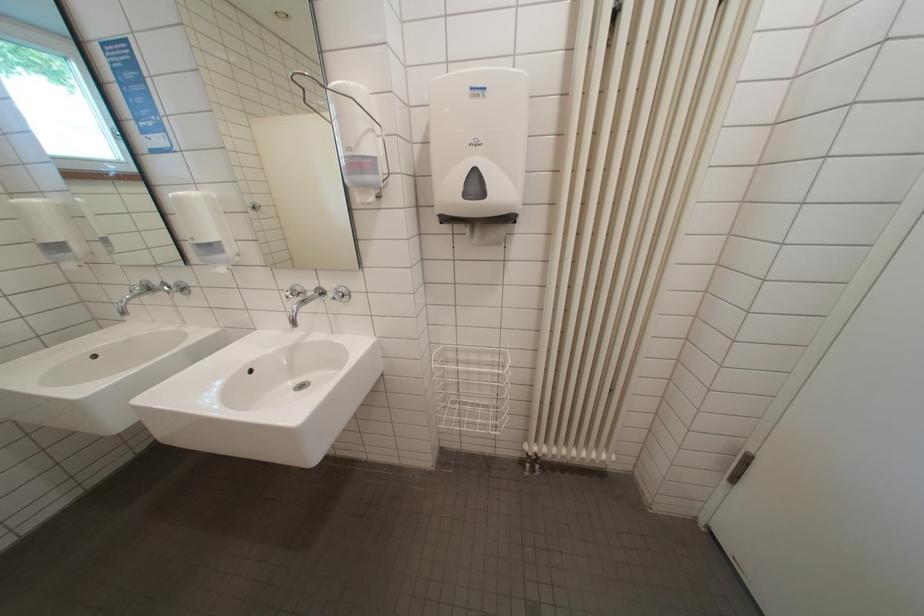
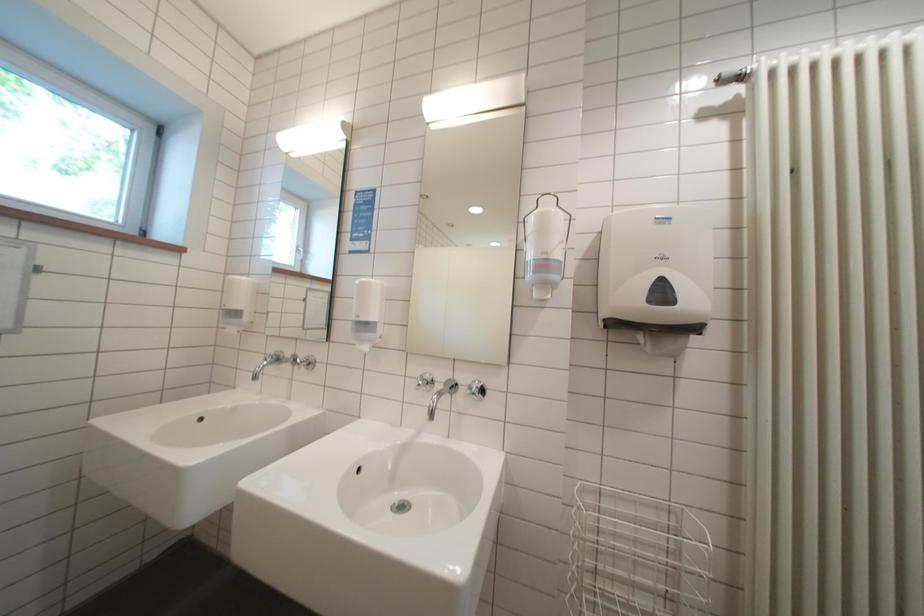
Question: Which direction would the cameraman need to move to produce the second image? Reply with the corresponding letter.

Choices:
 (A) Left
 (B) Right
 (C) Forward
 (D) Backward

Answer: (A)